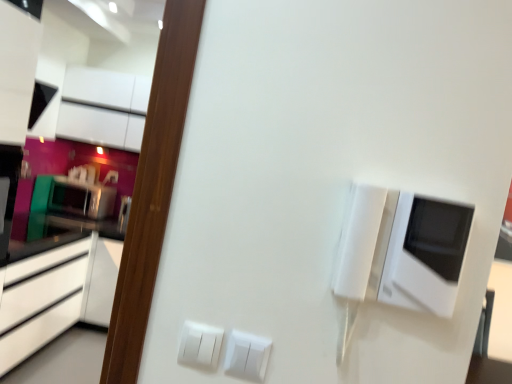
Question: Can you confirm if satin black microwave at left, which is counted as the 2th appliance, starting from the front, is shorter than white glossy microwave at upper right, which appears as the 2th appliance when viewed from the left?

Choices:
 (A) no
 (B) yes

Answer: (B)

Question: From the image's perspective, does satin black microwave at left, the first appliance when ordered from left to right, appear lower than white glossy microwave at upper right, the 2th appliance in the back-to-front sequence?

Choices:
 (A) no
 (B) yes

Answer: (A)

Question: Is satin black microwave at left, which is counted as the 2th appliance, starting from the front, bigger than white glossy microwave at upper right, which appears as the 2th appliance when viewed from the left?

Choices:
 (A) no
 (B) yes

Answer: (B)

Question: Considering the relative positions of satin black microwave at left, the second appliance from the right, and white glossy microwave at upper right, which appears as the 2th appliance when viewed from the left, in the image provided, is satin black microwave at left, the second appliance from the right, to the left of white glossy microwave at upper right, which appears as the 2th appliance when viewed from the left, from the viewer's perspective?

Choices:
 (A) yes
 (B) no

Answer: (A)

Question: Is satin black microwave at left, the second appliance from the right, looking in the opposite direction of white glossy microwave at upper right, the first appliance from the right?

Choices:
 (A) no
 (B) yes

Answer: (A)

Question: Is satin black microwave at left, the second appliance from the right, smaller than white glossy microwave at upper right, the first appliance from the right?

Choices:
 (A) yes
 (B) no

Answer: (B)

Question: Is white plastic switch at lower center, placed as the 2th electric outlet when sorted from left to right, located within white glossy microwave at upper right, the first appliance from the right?

Choices:
 (A) no
 (B) yes

Answer: (A)

Question: Is white glossy microwave at upper right, which appears as the 2th appliance when viewed from the left, placed right next to white plastic switch at lower center, placed as the 2th electric outlet when sorted from left to right?

Choices:
 (A) no
 (B) yes

Answer: (A)

Question: Considering the relative sizes of white glossy microwave at upper right, which appears as the 2th appliance when viewed from the left, and white plastic switch at lower center, the first electric outlet positioned from the right, in the image provided, is white glossy microwave at upper right, which appears as the 2th appliance when viewed from the left, bigger than white plastic switch at lower center, the first electric outlet positioned from the right,?

Choices:
 (A) yes
 (B) no

Answer: (A)

Question: From the image's perspective, does white glossy microwave at upper right, the 2th appliance in the back-to-front sequence, appear higher than white plastic switch at lower center, placed as the 2th electric outlet when sorted from left to right?

Choices:
 (A) no
 (B) yes

Answer: (B)

Question: Considering the relative sizes of white glossy microwave at upper right, the first appliance positioned from the front, and white plastic switch at lower center, placed as the 2th electric outlet when sorted from left to right, in the image provided, is white glossy microwave at upper right, the first appliance positioned from the front, taller than white plastic switch at lower center, placed as the 2th electric outlet when sorted from left to right,?

Choices:
 (A) no
 (B) yes

Answer: (B)

Question: From the image's perspective, does white glossy microwave at upper right, the first appliance positioned from the front, appear lower than white plastic switch at lower center, the first electric outlet positioned from the right?

Choices:
 (A) no
 (B) yes

Answer: (A)

Question: Is satin black microwave at left, the first appliance when ordered from left to right, smaller than matte black cabinet at upper left, arranged as the 1th cabinetry when viewed from the top?

Choices:
 (A) no
 (B) yes

Answer: (B)